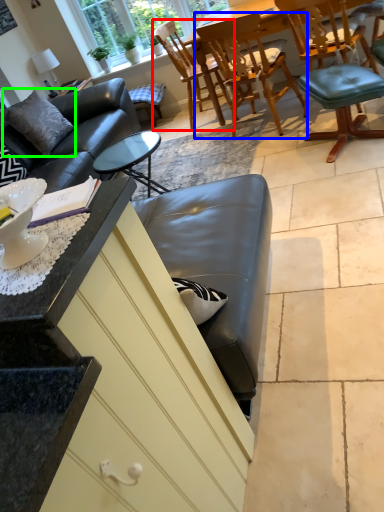
Question: Estimate the real-world distances between objects in this image. Which object is closer to chair (highlighted by a red box), chair (highlighted by a blue box) or pillow (highlighted by a green box)?

Choices:
 (A) chair
 (B) pillow

Answer: (A)